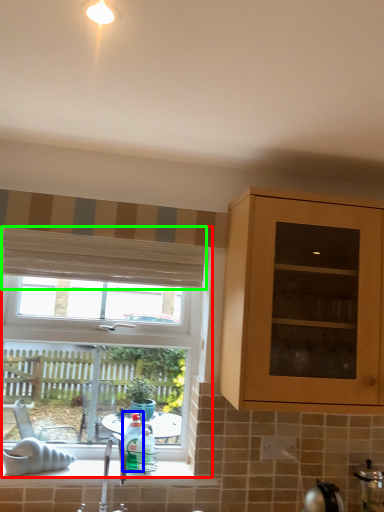
Question: Considering the real-world distances, which object is closest to window (highlighted by a red box)? bottle (highlighted by a blue box) or curtain (highlighted by a green box).

Choices:
 (A) bottle
 (B) curtain

Answer: (B)